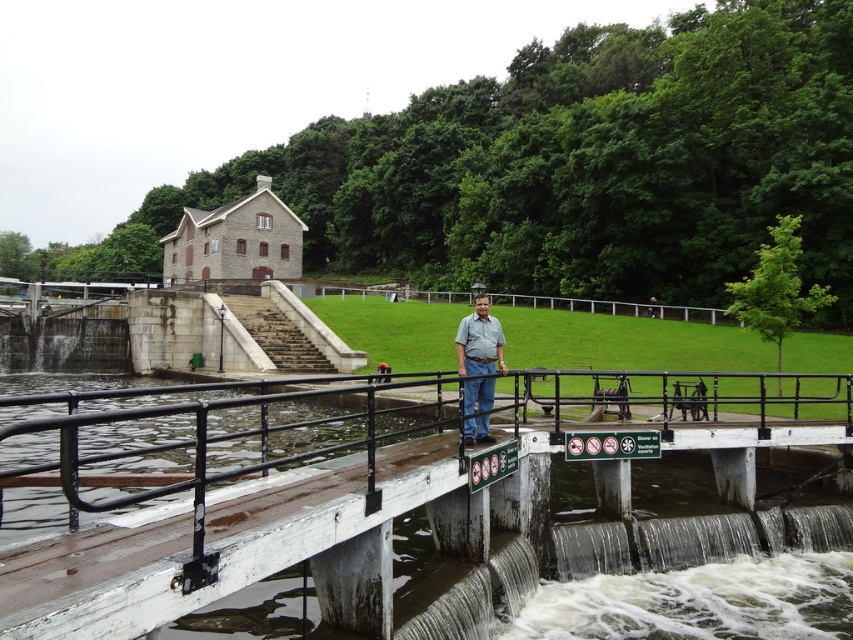
Question: Can you confirm if white painted wood rail at center is positioned above green fabric shirt at center?

Choices:
 (A) yes
 (B) no

Answer: (B)

Question: Is white painted wood rail at center smaller than green fabric shirt at center?

Choices:
 (A) no
 (B) yes

Answer: (A)

Question: Which object is farther from the camera taking this photo?

Choices:
 (A) white painted wood rail at center
 (B) green fabric shirt at center

Answer: (B)

Question: Which point is farther to the camera?

Choices:
 (A) white painted wood rail at center
 (B) green fabric shirt at center

Answer: (B)

Question: Does white painted wood rail at center lie behind green fabric shirt at center?

Choices:
 (A) yes
 (B) no

Answer: (B)